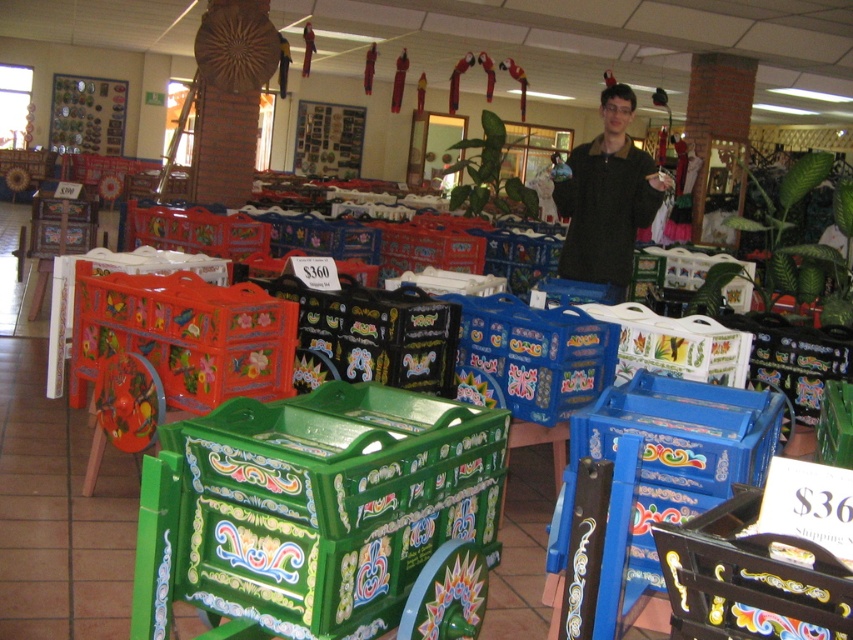
Is green plastic crate at center bigger than painted wood crate at center?

Yes, green plastic crate at center is bigger than painted wood crate at center.

Does green plastic crate at center lie in front of painted wood crate at center?

No, green plastic crate at center is behind painted wood crate at center.

Who is more forward, (x=256, y=556) or (x=817, y=624)?

Point (x=817, y=624) is more forward.

Locate an element on the screen. This screenshot has height=640, width=853. green plastic crate at center is located at coordinates (318, 504).

Does painted wood crate at center come in front of dark green textured shirt at center?

Yes, it is.

Which is behind, point (727, 589) or point (614, 289)?

The point (614, 289) is behind.

The image size is (853, 640). What do you see at coordinates (749, 579) in the screenshot?
I see `painted wood crate at center` at bounding box center [749, 579].

Find the location of a particular element. The width and height of the screenshot is (853, 640). painted wood crate at center is located at coordinates (749, 579).

Does green plastic crate at center appear on the left side of dark green textured shirt at center?

Indeed, green plastic crate at center is positioned on the left side of dark green textured shirt at center.

Is green plastic crate at center positioned in front of dark green textured shirt at center?

Yes, green plastic crate at center is closer to the viewer.

This screenshot has width=853, height=640. Find the location of `green plastic crate at center`. green plastic crate at center is located at coordinates (318, 504).